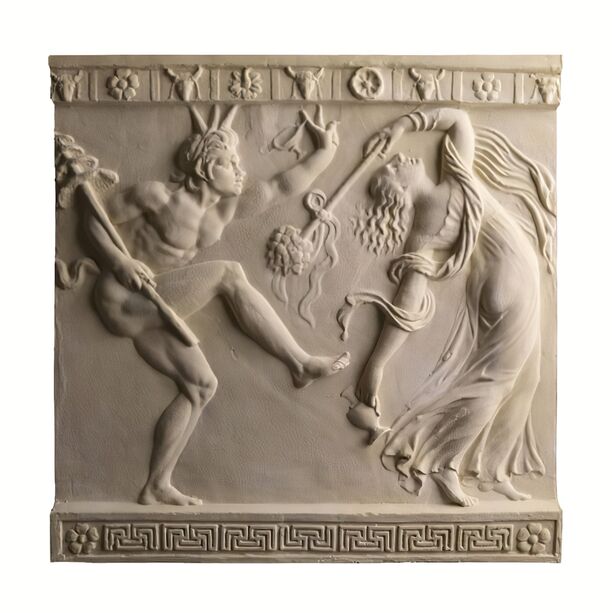
Identify the location of vase. The width and height of the screenshot is (612, 613). (362, 416).